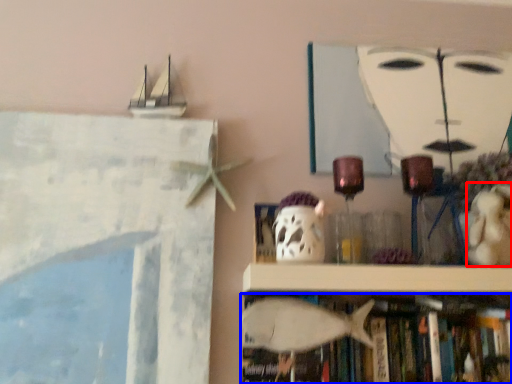
Question: Which of the following is the closest to the observer, toy (highlighted by a red box) or book (highlighted by a blue box)?

Choices:
 (A) toy
 (B) book

Answer: (A)